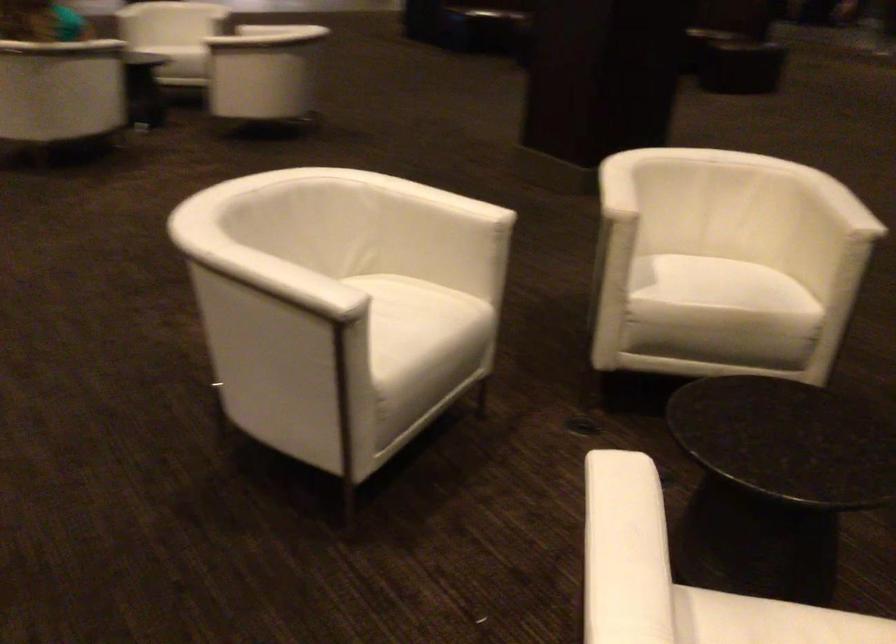
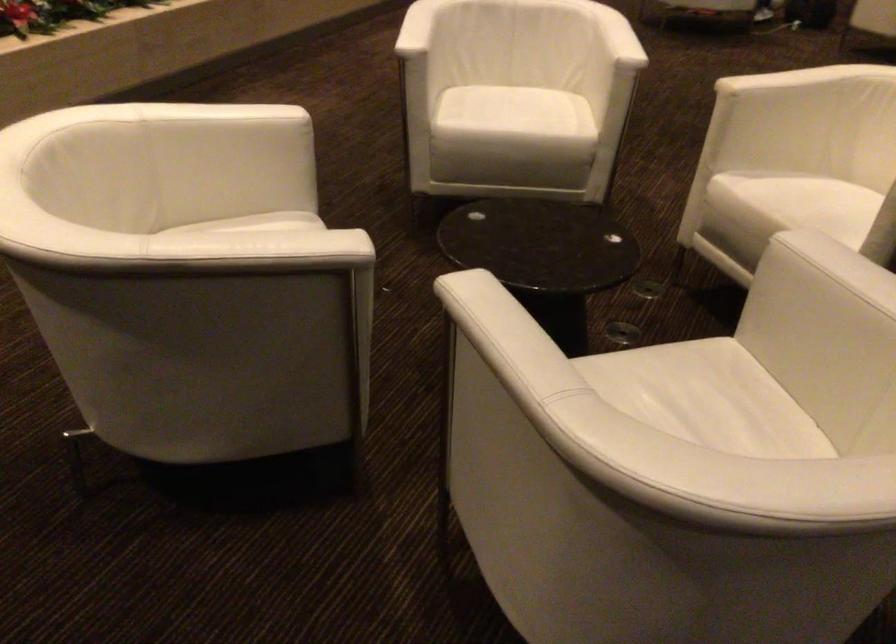
In the second image, find the point that corresponds to (298,270) in the first image.

(417, 28)